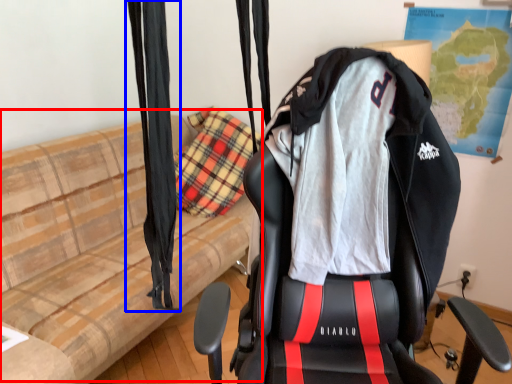
Question: Which of the following is the closest to the observer, couch (highlighted by a red box) or curtain (highlighted by a blue box)?

Choices:
 (A) couch
 (B) curtain

Answer: (B)